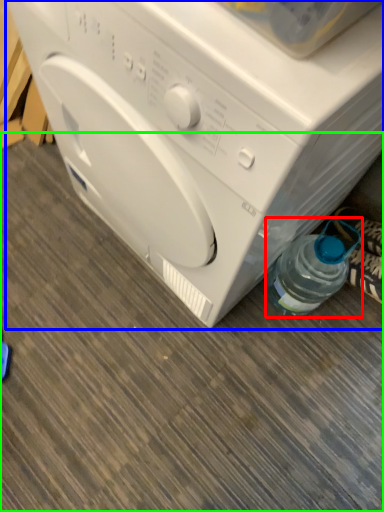
Question: Considering the real-world distances, which object is farthest from bottle (highlighted by a red box)? washing machine (highlighted by a blue box) or surface (highlighted by a green box)?

Choices:
 (A) washing machine
 (B) surface

Answer: (B)